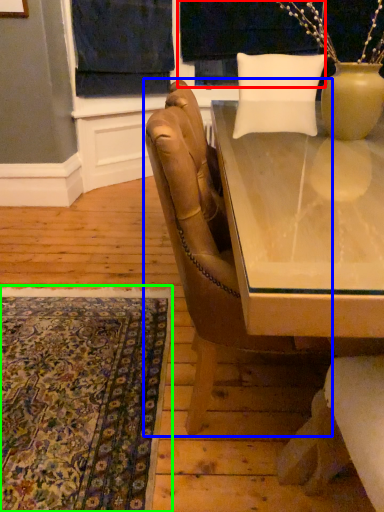
Question: Estimate the real-world distances between objects in this image. Which object is closer to window screen (highlighted by a red box), chair (highlighted by a blue box) or mat (highlighted by a green box)?

Choices:
 (A) chair
 (B) mat

Answer: (A)